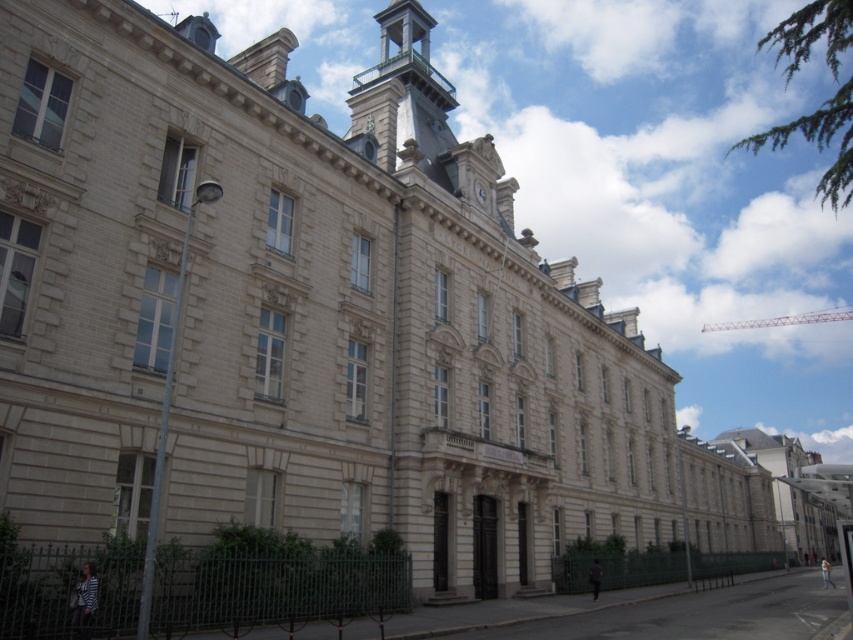
Consider the image. You are an architect designing a new addition to the building. You need to ensure that the distance between the polished brass bell tower at upper center and the white stone clock at upper center is maintained at exactly 50 feet. Based on the current measurements, is the distance sufficient or does it need adjustment?

The polished brass bell tower at upper center is currently 48.44 feet from the white stone clock at upper center, which is less than the required 50 feet. Therefore, the distance needs to be adjusted to meet the requirement.

In the scene shown: You are an architect examining the building from the ground floor. Which object, the polished brass bell tower at upper center or the white stone clock at upper center, is positioned higher in the structure?

The polished brass bell tower at upper center is positioned higher in the structure as it is located above the white stone clock at upper center.

You are an architect examining the building and need to determine the spatial relationship between the polished brass bell tower at upper center and the white stone clock at upper center. Which one is located to the left of the other?

The polished brass bell tower at upper center is positioned on the left side of white stone clock at upper center.